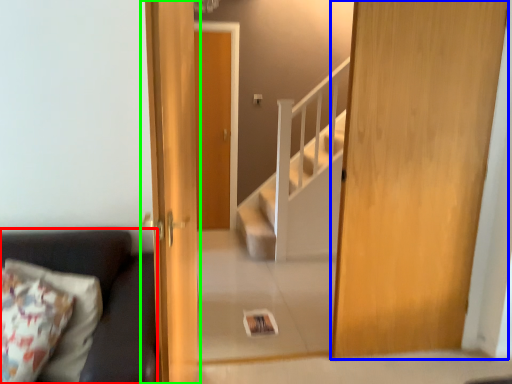
Question: Estimate the real-world distances between objects in this image. Which object is closer to studio couch (highlighted by a red box), door (highlighted by a blue box) or door (highlighted by a green box)?

Choices:
 (A) door
 (B) door

Answer: (B)